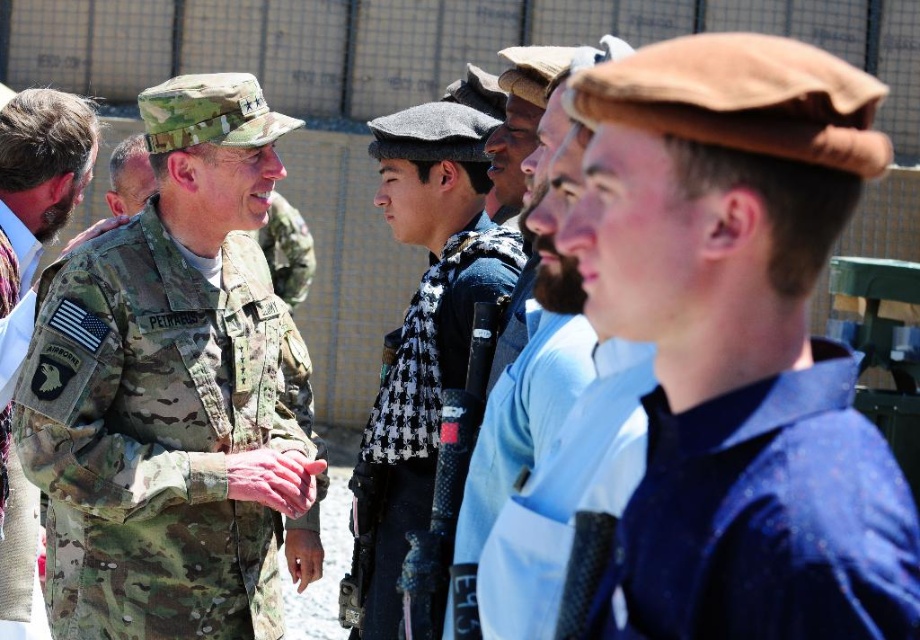
Question: Which of the following is the closest to the observer?

Choices:
 (A) (420, 342)
 (B) (132, 397)

Answer: (B)

Question: Does camouflage uniform at center appear on the right side of camouflage uniform at left?

Choices:
 (A) no
 (B) yes

Answer: (B)

Question: Which is farther from the brown felt cap at center?

Choices:
 (A) camouflage uniform at left
 (B) black and white checkered scarf at center

Answer: (A)

Question: Does camouflage uniform at center have a lesser width compared to black and white checkered scarf at center?

Choices:
 (A) yes
 (B) no

Answer: (B)

Question: Which point is closer to the camera?

Choices:
 (A) camouflage uniform at center
 (B) brown felt cap at center

Answer: (B)

Question: Observing the image, what is the correct spatial positioning of brown felt cap at center in reference to black and white checkered scarf at center?

Choices:
 (A) left
 (B) right

Answer: (B)